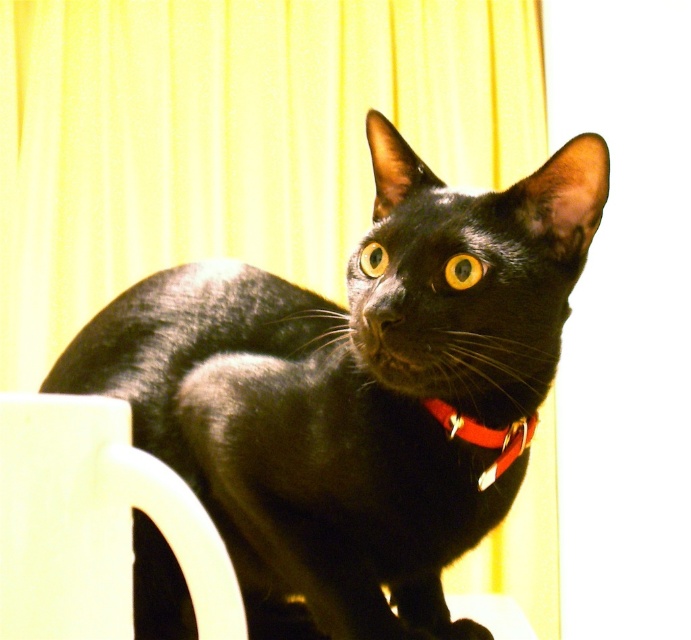
Is shiny black cat at center positioned behind yellow fabric curtain at upper center?

No, shiny black cat at center is in front of yellow fabric curtain at upper center.

Can you confirm if shiny black cat at center is wider than yellow fabric curtain at upper center?

In fact, shiny black cat at center might be narrower than yellow fabric curtain at upper center.

Between point (406, 611) and point (258, 45), which one is positioned in front?

Point (406, 611)

You are a GUI agent. You are given a task and a screenshot of the screen. Output one action in this format:
    pyautogui.click(x=<x>, y=<y>)
    Task: Click on the shiny black cat at center
    Image resolution: width=691 pixels, height=640 pixels.
    Given the screenshot: What is the action you would take?
    (x=354, y=390)

Can you confirm if white matte mug at lower left is shorter than red leather collar at center?

In fact, white matte mug at lower left may be taller than red leather collar at center.

Is white matte mug at lower left below red leather collar at center?

Indeed, white matte mug at lower left is positioned under red leather collar at center.

Which is in front, point (164, 536) or point (451, 436)?

Point (164, 536)

Locate an element on the screen. The image size is (691, 640). white matte mug at lower left is located at coordinates (93, 524).

Between yellow fabric curtain at upper center and white matte mug at lower left, which one is positioned higher?

yellow fabric curtain at upper center is higher up.

Does yellow fabric curtain at upper center have a greater width compared to white matte mug at lower left?

Correct, the width of yellow fabric curtain at upper center exceeds that of white matte mug at lower left.

Is point (106, 204) more distant than point (218, 561)?

Yes, point (106, 204) is farther from viewer.

The image size is (691, 640). What are the coordinates of `yellow fabric curtain at upper center` in the screenshot? It's located at (231, 138).